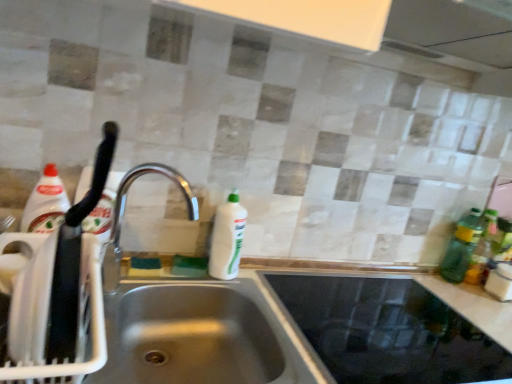
In order to click on empty space that is to the right of white glossy bottle at center in this screenshot , I will do `click(264, 278)`.